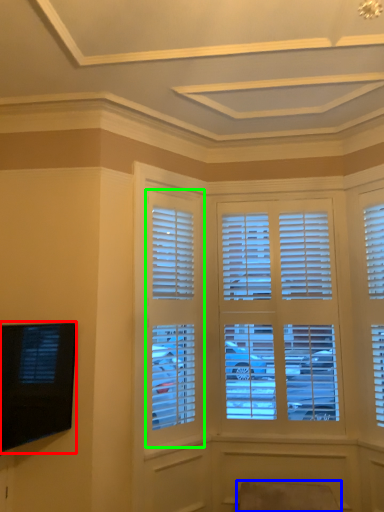
Question: Which object is the closest to the television (highlighted by a red box)? Choose among these: swivel chair (highlighted by a blue box) or window (highlighted by a green box).

Choices:
 (A) swivel chair
 (B) window

Answer: (B)